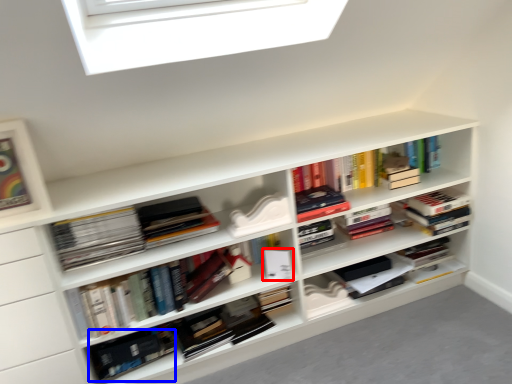
Question: Which of the following is the farthest to the observer, paperback book (highlighted by a red box) or book (highlighted by a blue box)?

Choices:
 (A) paperback book
 (B) book

Answer: (A)